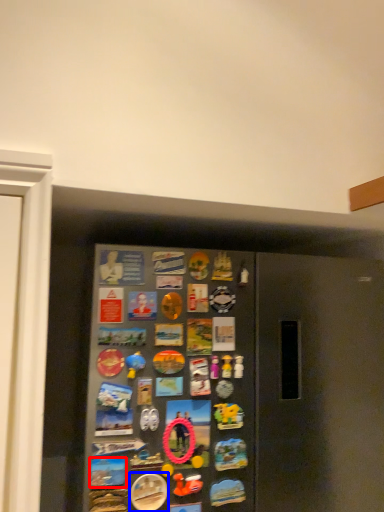
Question: Which object is closer to the camera taking this photo, button (highlighted by a red box) or button (highlighted by a blue box)?

Choices:
 (A) button
 (B) button

Answer: (A)